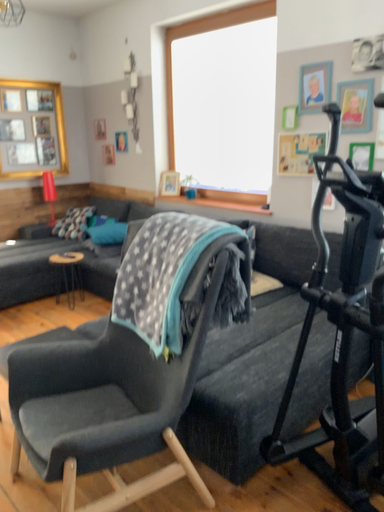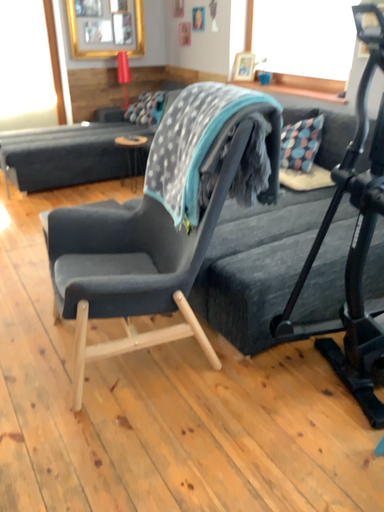
Question: Which way did the camera rotate in the video?

Choices:
 (A) rotated downward
 (B) rotated upward

Answer: (A)